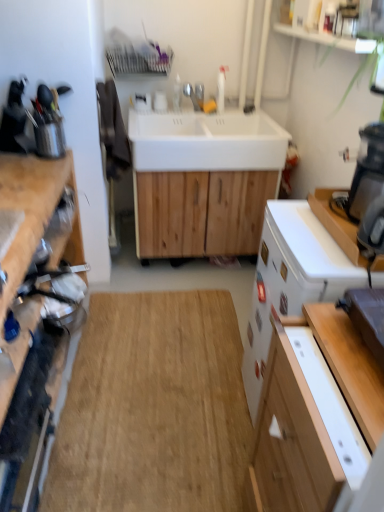
In order to click on vacant area situated to the left side of white glossy table at lower right in this screenshot , I will do `click(309, 369)`.